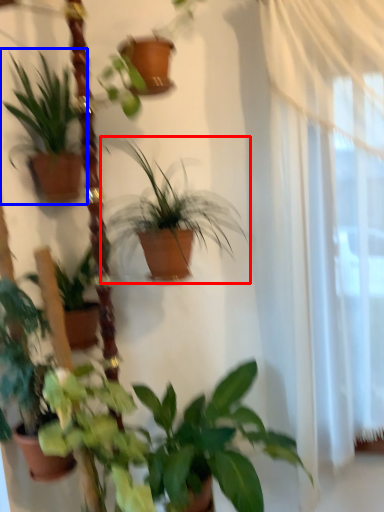
Question: Which of the following is the closest to the observer, houseplant (highlighted by a red box) or houseplant (highlighted by a blue box)?

Choices:
 (A) houseplant
 (B) houseplant

Answer: (A)